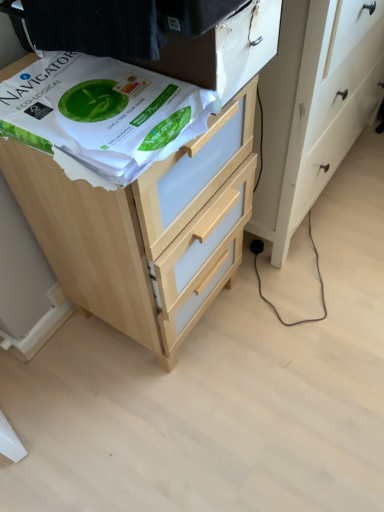
Describe the element at coordinates (140, 229) in the screenshot. I see `light wood chest of drawers at upper center` at that location.

This screenshot has width=384, height=512. Identify the location of light wood chest of drawers at upper center. (140, 229).

Measure the distance between point (139, 248) and camera.

A distance of 33.23 inches exists between point (139, 248) and camera.

Image resolution: width=384 pixels, height=512 pixels. Identify the location of white paper at upper left. (102, 115).

What do you see at coordinates (102, 115) in the screenshot? This screenshot has width=384, height=512. I see `white paper at upper left` at bounding box center [102, 115].

Measure the distance between white paper at upper left and camera.

The distance of white paper at upper left from camera is 23.96 inches.

The width and height of the screenshot is (384, 512). In order to click on light wood chest of drawers at upper center in this screenshot , I will do `click(140, 229)`.

Between white paper at upper left and light wood chest of drawers at upper center, which one appears on the right side from the viewer's perspective?

Positioned to the right is light wood chest of drawers at upper center.

Does white paper at upper left come in front of light wood chest of drawers at upper center?

Yes, it is.

Between point (20, 88) and point (93, 224), which one is positioned behind?

Point (93, 224)

From the image's perspective, which object appears higher, white paper at upper left or light wood chest of drawers at upper center?

white paper at upper left.

From a real-world perspective, is white paper at upper left positioned over light wood chest of drawers at upper center based on gravity?

Yes, from a real-world perspective, white paper at upper left is above light wood chest of drawers at upper center.

Can you confirm if white paper at upper left is thinner than light wood chest of drawers at upper center?

Yes, white paper at upper left is thinner than light wood chest of drawers at upper center.

Considering the sizes of objects white paper at upper left and light wood chest of drawers at upper center in the image provided, who is taller, white paper at upper left or light wood chest of drawers at upper center?

light wood chest of drawers at upper center.

Can you confirm if white paper at upper left is smaller than light wood chest of drawers at upper center?

Correct, white paper at upper left occupies less space than light wood chest of drawers at upper center.

Is white paper at upper left spatially inside light wood chest of drawers at upper center, or outside of it?

white paper at upper left is located beyond the bounds of light wood chest of drawers at upper center.

Is white paper at upper left placed right next to light wood chest of drawers at upper center?

No, white paper at upper left is not next to light wood chest of drawers at upper center.

Is white paper at upper left positioned with its back to light wood chest of drawers at upper center?

white paper at upper left does not have its back to light wood chest of drawers at upper center.

I want to click on wrapping paper that is in front of the light wood chest of drawers at upper center, so click(x=102, y=115).

Considering the positions of objects light wood chest of drawers at upper center and white paper at upper left in the image provided, who is more to the left, light wood chest of drawers at upper center or white paper at upper left?

From the viewer's perspective, white paper at upper left appears more on the left side.

Considering their positions, is light wood chest of drawers at upper center located in front of or behind white paper at upper left?

Visually, light wood chest of drawers at upper center is located behind white paper at upper left.

Which is in front, point (171, 201) or point (111, 60)?

The point (111, 60) is closer to the camera.

From the image's perspective, relative to white paper at upper left, is light wood chest of drawers at upper center above or below?

light wood chest of drawers at upper center is below white paper at upper left.

From a real-world perspective, which object rests below the other?

light wood chest of drawers at upper center is physically lower.

Considering the sizes of objects light wood chest of drawers at upper center and white paper at upper left in the image provided, who is thinner, light wood chest of drawers at upper center or white paper at upper left?

With smaller width is white paper at upper left.

Who is taller, light wood chest of drawers at upper center or white paper at upper left?

light wood chest of drawers at upper center is taller.

Is light wood chest of drawers at upper center smaller than white paper at upper left?

No, light wood chest of drawers at upper center is not smaller than white paper at upper left.

Choose the correct answer: Is light wood chest of drawers at upper center inside white paper at upper left or outside it?

light wood chest of drawers at upper center is not inside white paper at upper left, it's outside.

Is light wood chest of drawers at upper center directly adjacent to white paper at upper left?

No, light wood chest of drawers at upper center is not touching white paper at upper left.

Is light wood chest of drawers at upper center looking in the opposite direction of white paper at upper left?

light wood chest of drawers at upper center does not have its back to white paper at upper left.

How different are the orientations of light wood chest of drawers at upper center and white paper at upper left in degrees?

0.504 degrees.

I want to click on the chest of drawers below the white paper at upper left (from the image's perspective), so click(x=140, y=229).

You are a GUI agent. You are given a task and a screenshot of the screen. Output one action in this format:
    pyautogui.click(x=<x>, y=<y>)
    Task: Click on the wrapping paper above the light wood chest of drawers at upper center (from a real-world perspective)
    The image size is (384, 512).
    Given the screenshot: What is the action you would take?
    pyautogui.click(x=102, y=115)

In order to click on wrapping paper in front of the light wood chest of drawers at upper center in this screenshot , I will do `click(102, 115)`.